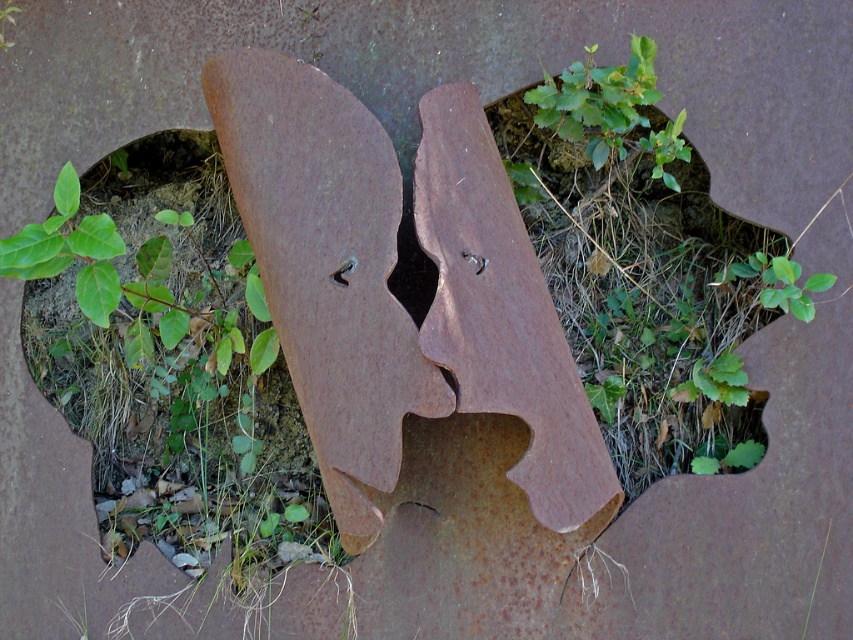
You are standing in front of the metal sculpture and notice the green leafy plant at upper center. Can you determine its exact position relative to the sculpture?

The green leafy plant at upper center is located at point coordinates of (598, 100).